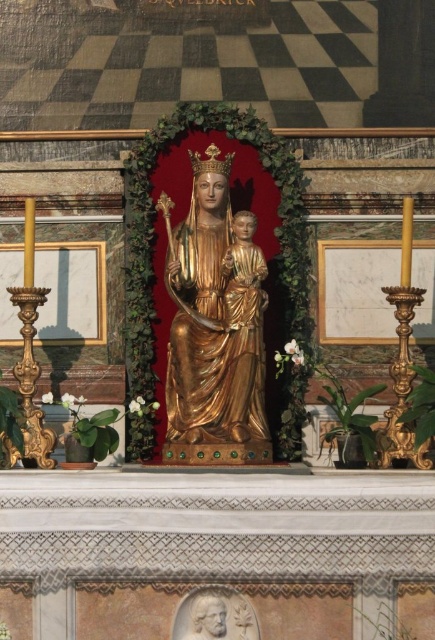
You are an interior designer planning to place a new decorative item between the gold polished statue at center and the white marble bust at lower center. Considering their sizes, which object should you position closer to the center of the altar to maintain visual balance?

The gold polished statue at center is larger in size than the white marble bust at lower center. To maintain visual balance, position the smaller white marble bust at lower center closer to the center of the altar while placing the larger gold polished statue at center further out. This way, the scale difference is balanced by their placement distances.

You are standing in front of the religious altar and want to determine which of the two points, point (260, 365) or point (174, 637), is closer to you. Based on the description, which point is nearer to your current position?

Point (174, 637) is closer to you because it is less further to the camera than point (260, 365) according to the description.